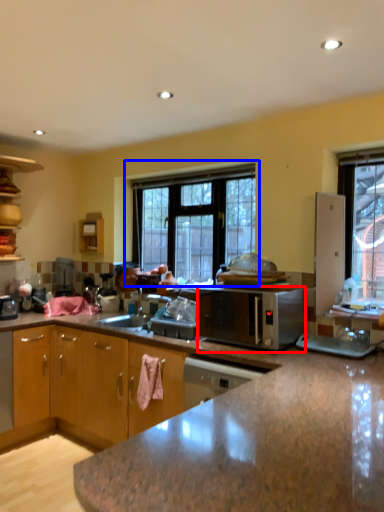
Question: Among these objects, which one is nearest to the camera, microwave oven (highlighted by a red box) or window (highlighted by a blue box)?

Choices:
 (A) microwave oven
 (B) window

Answer: (A)